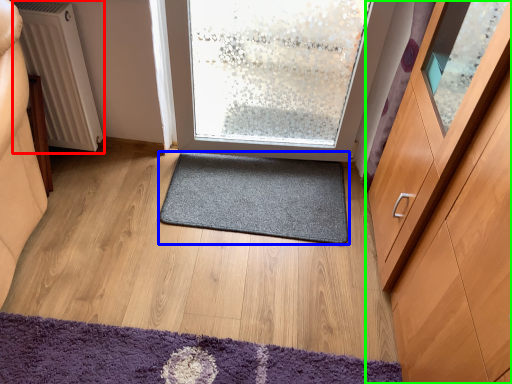
Question: Based on their relative distances, which object is farther from radiator (highlighted by a red box)? Choose from mat (highlighted by a blue box) and cabinetry (highlighted by a green box).

Choices:
 (A) mat
 (B) cabinetry

Answer: (B)